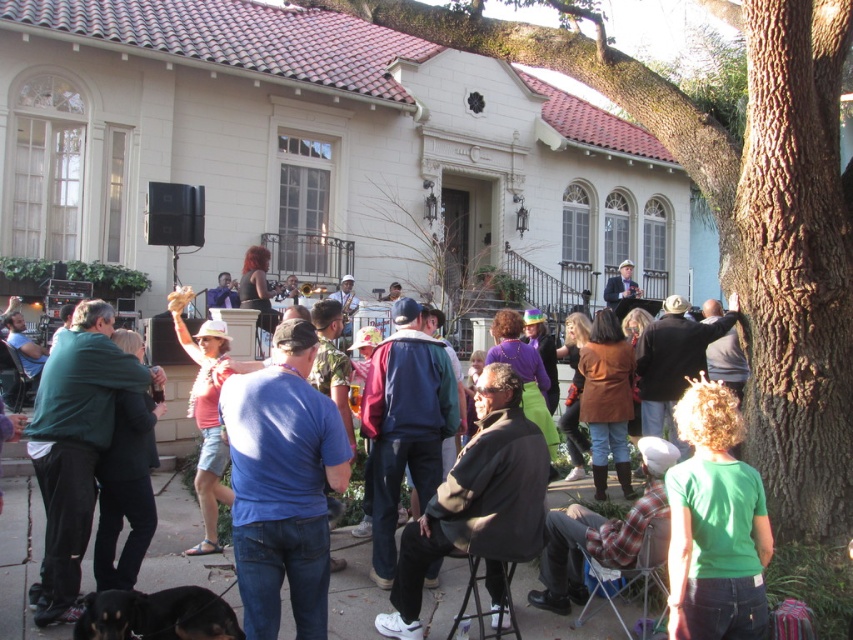
Measure the distance from flannel shirt at lower center to matte blue shirt at center.

A distance of 14.85 meters exists between flannel shirt at lower center and matte blue shirt at center.

Is flannel shirt at lower center wider than matte blue shirt at center?

Yes, flannel shirt at lower center is wider than matte blue shirt at center.

What are the coordinates of `flannel shirt at lower center` in the screenshot? It's located at (604, 534).

Is green matte shirt at lower right bigger than matte blue shirt at center?

No, green matte shirt at lower right is not bigger than matte blue shirt at center.

Who is positioned more to the left, green matte shirt at lower right or matte blue shirt at center?

green matte shirt at lower right

Which is behind, point (671, 513) or point (630, 285)?

The point (630, 285) is more distant.

Where is `green matte shirt at lower right`? This screenshot has width=853, height=640. green matte shirt at lower right is located at coordinates (715, 524).

Which is more to the right, green matte jacket at left or pink fabric shirt at center?

pink fabric shirt at center is more to the right.

Does green matte jacket at left have a greater width compared to pink fabric shirt at center?

No.

Locate an element on the screen. green matte jacket at left is located at coordinates (74, 445).